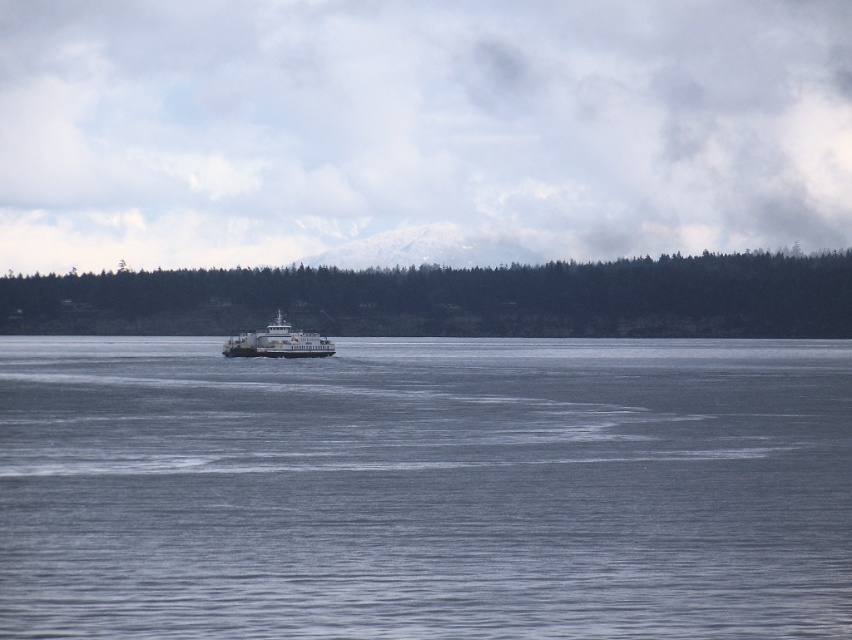
You are standing on the ferry and looking out at the scene. Which object is closer to you between the gray water at center and the dark green forest at center?

The gray water at center is closer to you because it is positioned under the dark green forest at center, meaning the forest is further away.